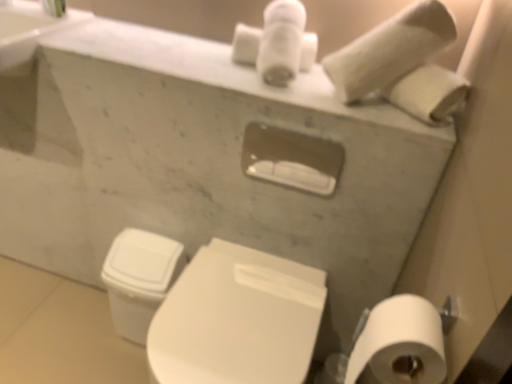
Locate an element on the screen. The width and height of the screenshot is (512, 384). white glossy toilet bowl at lower left is located at coordinates (139, 278).

What do you see at coordinates (28, 33) in the screenshot? This screenshot has height=384, width=512. I see `white marble sink at upper left` at bounding box center [28, 33].

Find the location of a particular element. The height and width of the screenshot is (384, 512). white glossy toilet bowl at lower left is located at coordinates (139, 278).

From a real-world perspective, is white glossy toilet bowl at lower left positioned above or below white matte toilet paper at lower right, positioned as the 2th toilet paper in top-to-bottom order?

white glossy toilet bowl at lower left is situated lower than white matte toilet paper at lower right, positioned as the 2th toilet paper in top-to-bottom order, in the real world.

Would you say white glossy toilet bowl at lower left contains white matte toilet paper at lower right, the 1th toilet paper positioned from the bottom?

That's incorrect, white matte toilet paper at lower right, the 1th toilet paper positioned from the bottom, is not inside white glossy toilet bowl at lower left.

Considering the relative positions of white glossy toilet bowl at lower left and white matte toilet paper at lower right, positioned as the 2th toilet paper in top-to-bottom order, in the image provided, is white glossy toilet bowl at lower left behind white matte toilet paper at lower right, positioned as the 2th toilet paper in top-to-bottom order,?

Yes, white glossy toilet bowl at lower left is behind white matte toilet paper at lower right, positioned as the 2th toilet paper in top-to-bottom order.

Visually, is white glossy toilet bowl at lower left positioned to the left or to the right of white matte toilet paper at lower right, positioned as the first toilet paper in front-to-back order?

From the image, it's evident that white glossy toilet bowl at lower left is to the left of white matte toilet paper at lower right, positioned as the first toilet paper in front-to-back order.

There is a white marble sink at upper left. At what (x,y) coordinates should I click in order to perform the action: click on the 1st toilet paper below it (from the image's perspective). Please return your answer as a coordinate pair (x, y). The image size is (512, 384). Looking at the image, I should click on (390, 50).

Is white marble sink at upper left taller or shorter than white matte toilet paper at upper right, marked as the 1th toilet paper in a back-to-front arrangement?

Clearly, white marble sink at upper left is shorter compared to white matte toilet paper at upper right, marked as the 1th toilet paper in a back-to-front arrangement.

Based on their sizes in the image, would you say white marble sink at upper left is bigger or smaller than white matte toilet paper at upper right, which ranks as the second toilet paper in bottom-to-top order?

Considering their sizes, white marble sink at upper left takes up more space than white matte toilet paper at upper right, which ranks as the second toilet paper in bottom-to-top order.

From a real-world perspective, is white matte toilet paper at lower right, positioned as the 2th toilet paper in top-to-bottom order, physically above white matte toilet paper at upper right, marked as the first toilet paper in a top-to-bottom arrangement?

No, from a real-world perspective, white matte toilet paper at lower right, positioned as the 2th toilet paper in top-to-bottom order, is not above white matte toilet paper at upper right, marked as the first toilet paper in a top-to-bottom arrangement.

Who is more distant, white matte toilet paper at lower right, the 1th toilet paper positioned from the bottom, or white matte toilet paper at upper right, which is the 2th toilet paper from front to back?

white matte toilet paper at upper right, which is the 2th toilet paper from front to back, is further away from the camera.

Is point (379, 325) positioned in front of point (389, 25)?

Yes.

How different are the orientations of white matte toilet paper at lower right, positioned as the first toilet paper in front-to-back order, and white matte toilet paper at upper right, marked as the 1th toilet paper in a back-to-front arrangement, in degrees?

The angular difference between white matte toilet paper at lower right, positioned as the first toilet paper in front-to-back order, and white matte toilet paper at upper right, marked as the 1th toilet paper in a back-to-front arrangement, is 89.8 degrees.

Can we say white marble sink at upper left lies outside white glossy toilet bowl at lower left?

Yes, white marble sink at upper left is not within white glossy toilet bowl at lower left.

Looking at this image, which object is closer to the camera, white marble sink at upper left or white glossy toilet bowl at lower left?

white marble sink at upper left is more forward.

Is white glossy toilet bowl at lower left at the back of white marble sink at upper left?

No, white glossy toilet bowl at lower left is not at the back of white marble sink at upper left.

The height and width of the screenshot is (384, 512). What are the coordinates of `toilet bowl that appears below the white marble sink at upper left (from a real-world perspective)` in the screenshot? It's located at (139, 278).

Is white glossy toilet at lower center at the left side of white glossy toilet bowl at lower left?

In fact, white glossy toilet at lower center is to the right of white glossy toilet bowl at lower left.

In the scene shown: Does white glossy toilet at lower center have a larger size compared to white glossy toilet bowl at lower left?

Yes.

Which of these two, white glossy toilet at lower center or white glossy toilet bowl at lower left, is wider?

white glossy toilet at lower center is wider.

Is white glossy toilet bowl at lower left far away from white marble sink at upper left?

That's not correct — white glossy toilet bowl at lower left is a little close to white marble sink at upper left.

From a real-world perspective, is white glossy toilet bowl at lower left located beneath white marble sink at upper left?

Yes, from a real-world perspective, white glossy toilet bowl at lower left is below white marble sink at upper left.

Would you say white glossy toilet bowl at lower left is inside or outside white marble sink at upper left?

white glossy toilet bowl at lower left lies outside white marble sink at upper left.

Is white glossy toilet bowl at lower left bigger or smaller than white marble sink at upper left?

white glossy toilet bowl at lower left is smaller than white marble sink at upper left.

Does white matte toilet paper at upper right, which ranks as the second toilet paper in bottom-to-top order, turn towards white glossy toilet at lower center?

No.

From a real-world perspective, relative to white glossy toilet at lower center, is white matte toilet paper at upper right, marked as the first toilet paper in a top-to-bottom arrangement, vertically above or below?

white matte toilet paper at upper right, marked as the first toilet paper in a top-to-bottom arrangement, is above white glossy toilet at lower center.

Locate an element on the screen. The height and width of the screenshot is (384, 512). toilet paper behind the white glossy toilet at lower center is located at coordinates (390, 50).

Are white matte toilet paper at upper right, marked as the 1th toilet paper in a back-to-front arrangement, and white glossy toilet at lower center located far from each other?

That's not correct — white matte toilet paper at upper right, marked as the 1th toilet paper in a back-to-front arrangement, is a little close to white glossy toilet at lower center.

From a real-world perspective, starting from the white glossy toilet bowl at lower left, which toilet paper is the 1st one vertically above it? Please provide its 2D coordinates.

[(400, 343)]

The image size is (512, 384). I want to click on the 2nd toilet paper to the right of the white marble sink at upper left, counting from the anchor's position, so click(390, 50).

Which object lies nearer to the anchor point white glossy toilet bowl at lower left, white matte toilet paper at upper right, which is the 2th toilet paper from front to back, or white matte toilet paper at lower right, positioned as the 2th toilet paper in back-to-front order?

Among the two, white matte toilet paper at lower right, positioned as the 2th toilet paper in back-to-front order, is located nearer to white glossy toilet bowl at lower left.

From the image, which object appears to be farther from white glossy toilet bowl at lower left, white matte toilet paper at lower right, the 1th toilet paper positioned from the bottom, or white matte toilet paper at upper right, marked as the first toilet paper in a top-to-bottom arrangement?

Based on the image, white matte toilet paper at upper right, marked as the first toilet paper in a top-to-bottom arrangement, appears to be further to white glossy toilet bowl at lower left.

Considering their positions, is white matte toilet paper at lower right, positioned as the 2th toilet paper in top-to-bottom order, positioned closer to white marble sink at upper left than white matte toilet paper at upper right, which ranks as the second toilet paper in bottom-to-top order?

Among the two, white matte toilet paper at upper right, which ranks as the second toilet paper in bottom-to-top order, is located nearer to white marble sink at upper left.

Which object lies nearer to the anchor point white glossy toilet bowl at lower left, white marble sink at upper left or white glossy toilet at lower center?

Based on the image, white glossy toilet at lower center appears to be nearer to white glossy toilet bowl at lower left.

Considering their positions, is white matte toilet paper at upper right, marked as the 1th toilet paper in a back-to-front arrangement, positioned further to white glossy toilet at lower center than white glossy toilet bowl at lower left?

The object further to white glossy toilet at lower center is white matte toilet paper at upper right, marked as the 1th toilet paper in a back-to-front arrangement.

Looking at the image, which one is located further to white matte toilet paper at lower right, positioned as the 2th toilet paper in back-to-front order, white marble sink at upper left or white glossy toilet bowl at lower left?

The object further to white matte toilet paper at lower right, positioned as the 2th toilet paper in back-to-front order, is white marble sink at upper left.

Considering their positions, is white marble sink at upper left positioned further to white glossy toilet bowl at lower left than white matte toilet paper at lower right, the 1th toilet paper positioned from the bottom?

white matte toilet paper at lower right, the 1th toilet paper positioned from the bottom.

Considering their positions, is white glossy toilet bowl at lower left positioned further to white matte toilet paper at lower right, positioned as the 2th toilet paper in top-to-bottom order, than white matte toilet paper at upper right, marked as the first toilet paper in a top-to-bottom arrangement?

Based on the image, white glossy toilet bowl at lower left appears to be further to white matte toilet paper at lower right, positioned as the 2th toilet paper in top-to-bottom order.

Where is `toilet between white marble sink at upper left and white matte toilet paper at lower right, positioned as the first toilet paper in front-to-back order, in the horizontal direction`? toilet between white marble sink at upper left and white matte toilet paper at lower right, positioned as the first toilet paper in front-to-back order, in the horizontal direction is located at coordinates (237, 319).

This screenshot has width=512, height=384. What are the coordinates of `toilet paper between white matte toilet paper at upper right, which is the 2th toilet paper from front to back, and white glossy toilet bowl at lower left, in the vertical direction` in the screenshot? It's located at (400, 343).

Where is `toilet located between white matte toilet paper at lower right, positioned as the 2th toilet paper in back-to-front order, and white glossy toilet bowl at lower left in the depth direction`? toilet located between white matte toilet paper at lower right, positioned as the 2th toilet paper in back-to-front order, and white glossy toilet bowl at lower left in the depth direction is located at coordinates (237, 319).

Find the location of a particular element. This screenshot has width=512, height=384. toilet paper between white marble sink at upper left and white matte toilet paper at upper right, which is the 2th toilet paper from front to back, from left to right is located at coordinates (400, 343).